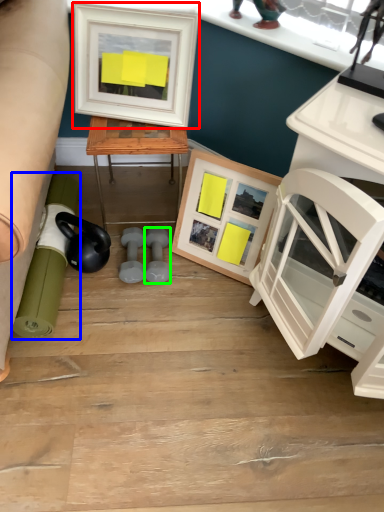
Question: Based on their relative distances, which object is nearer to picture frame (highlighted by a red box)? Choose from rolling pin (highlighted by a blue box) and dumbbell (highlighted by a green box).

Choices:
 (A) rolling pin
 (B) dumbbell

Answer: (B)